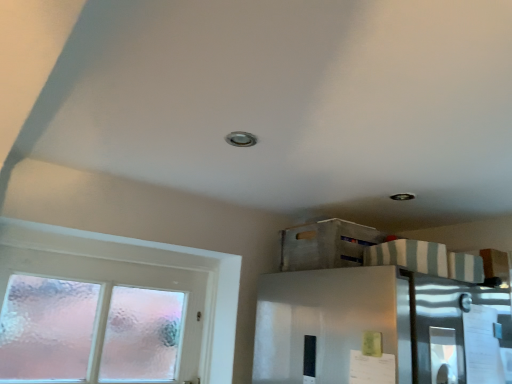
Where is `wooden crate at upper center`? wooden crate at upper center is located at coordinates 326,244.

This screenshot has width=512, height=384. What do you see at coordinates (326, 244) in the screenshot?
I see `wooden crate at upper center` at bounding box center [326, 244].

The image size is (512, 384). What are the coordinates of `wooden crate at upper center` in the screenshot? It's located at (326, 244).